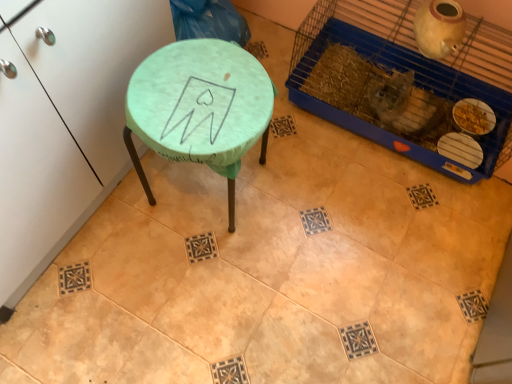
Question: Is green fabric-covered stool at upper left outside of blue plastic bird cage at upper right?

Choices:
 (A) yes
 (B) no

Answer: (A)

Question: Can you confirm if green fabric-covered stool at upper left is taller than blue plastic bird cage at upper right?

Choices:
 (A) yes
 (B) no

Answer: (A)

Question: Considering the relative sizes of green fabric-covered stool at upper left and blue plastic bird cage at upper right in the image provided, is green fabric-covered stool at upper left thinner than blue plastic bird cage at upper right?

Choices:
 (A) yes
 (B) no

Answer: (B)

Question: Would you say blue plastic bird cage at upper right is part of green fabric-covered stool at upper left's contents?

Choices:
 (A) yes
 (B) no

Answer: (B)

Question: From a real-world perspective, is green fabric-covered stool at upper left below blue plastic bird cage at upper right?

Choices:
 (A) no
 (B) yes

Answer: (A)

Question: From the image's perspective, relative to green fabric-covered stool at upper left, is matte green stool at center above or below?

Choices:
 (A) above
 (B) below

Answer: (B)

Question: Would you say matte green stool at center is inside or outside green fabric-covered stool at upper left?

Choices:
 (A) outside
 (B) inside

Answer: (A)

Question: Is point (263, 139) positioned closer to the camera than point (0, 264)?

Choices:
 (A) closer
 (B) farther

Answer: (B)

Question: Considering the positions of matte green stool at center and green fabric-covered stool at upper left in the image, is matte green stool at center taller or shorter than green fabric-covered stool at upper left?

Choices:
 (A) short
 (B) tall

Answer: (A)

Question: Is point (468, 34) positioned closer to the camera than point (27, 112)?

Choices:
 (A) closer
 (B) farther

Answer: (B)

Question: In terms of height, does blue plastic bird cage at upper right look taller or shorter compared to green fabric-covered stool at upper left?

Choices:
 (A) tall
 (B) short

Answer: (B)

Question: Is blue plastic bird cage at upper right bigger or smaller than green fabric-covered stool at upper left?

Choices:
 (A) big
 (B) small

Answer: (B)

Question: Which is correct: blue plastic bird cage at upper right is inside green fabric-covered stool at upper left, or outside of it?

Choices:
 (A) outside
 (B) inside

Answer: (A)

Question: Is blue plastic bird cage at upper right taller or shorter than matte green stool at center?

Choices:
 (A) tall
 (B) short

Answer: (B)

Question: Considering the relative positions of blue plastic bird cage at upper right and matte green stool at center in the image provided, is blue plastic bird cage at upper right to the left or to the right of matte green stool at center?

Choices:
 (A) right
 (B) left

Answer: (A)